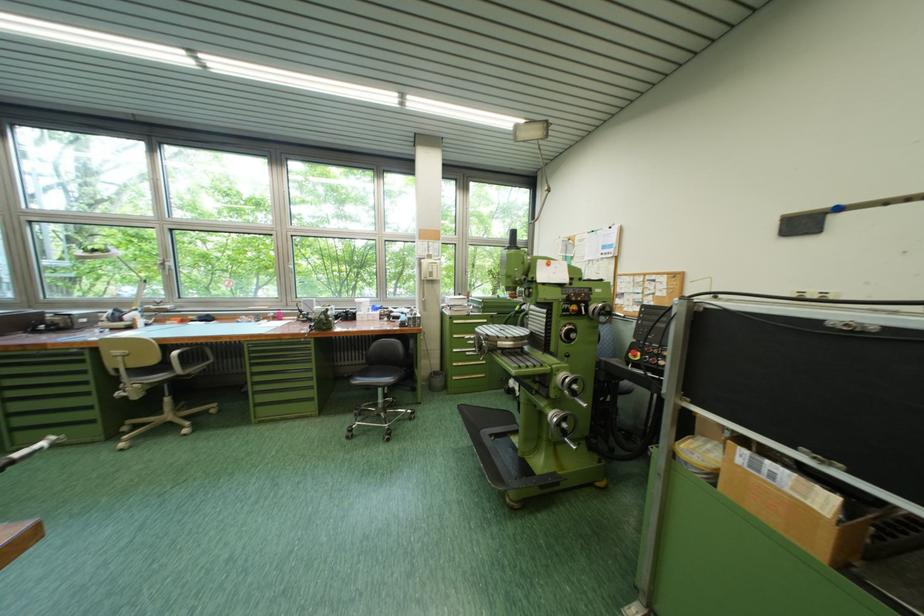
Where is `black chair seat`? The image size is (924, 616). black chair seat is located at coordinates (378, 376).